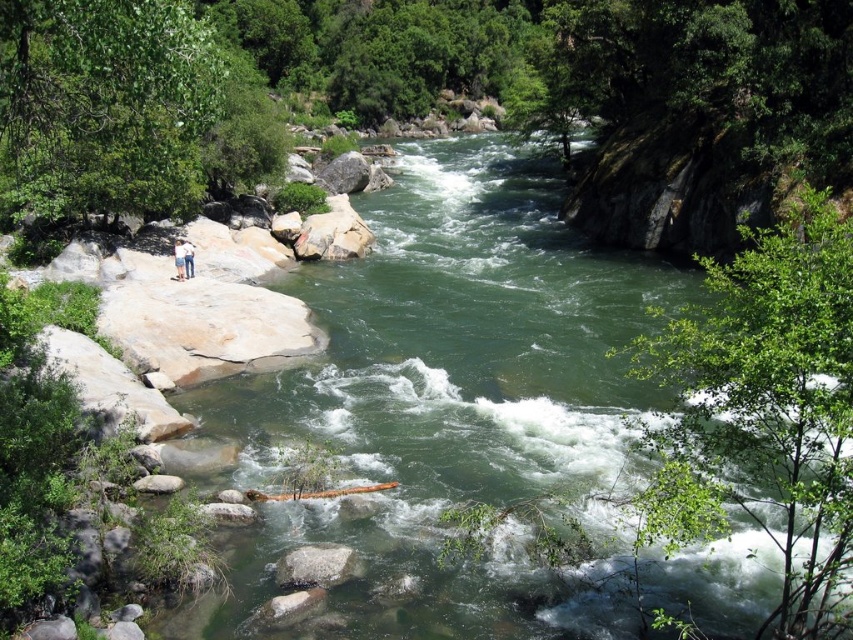
Is gray smooth rock at center closer to camera compared to blue jeans at lower left?

Yes, it is in front of blue jeans at lower left.

Who is positioned more to the left, gray smooth rock at center or blue jeans at lower left?

blue jeans at lower left

Does point (321, 561) come behind point (190, 244)?

No, it is not.

Locate an element on the screen. This screenshot has height=640, width=853. gray smooth rock at center is located at coordinates (317, 564).

From the picture: Can you confirm if green smooth water at center is thinner than gray smooth rock at center?

No.

Is green smooth water at center positioned at the back of gray smooth rock at center?

No, it is not.

Is point (473, 305) more distant than point (277, 570)?

Yes, it is behind point (277, 570).

Image resolution: width=853 pixels, height=640 pixels. I want to click on green smooth water at center, so click(x=450, y=406).

Does green smooth water at center come in front of light brown leather jacket at upper left?

Yes, it is in front of light brown leather jacket at upper left.

Looking at this image, who is higher up, green smooth water at center or light brown leather jacket at upper left?

Positioned higher is green smooth water at center.

The image size is (853, 640). Describe the element at coordinates (450, 406) in the screenshot. I see `green smooth water at center` at that location.

Image resolution: width=853 pixels, height=640 pixels. I want to click on green smooth water at center, so click(x=450, y=406).